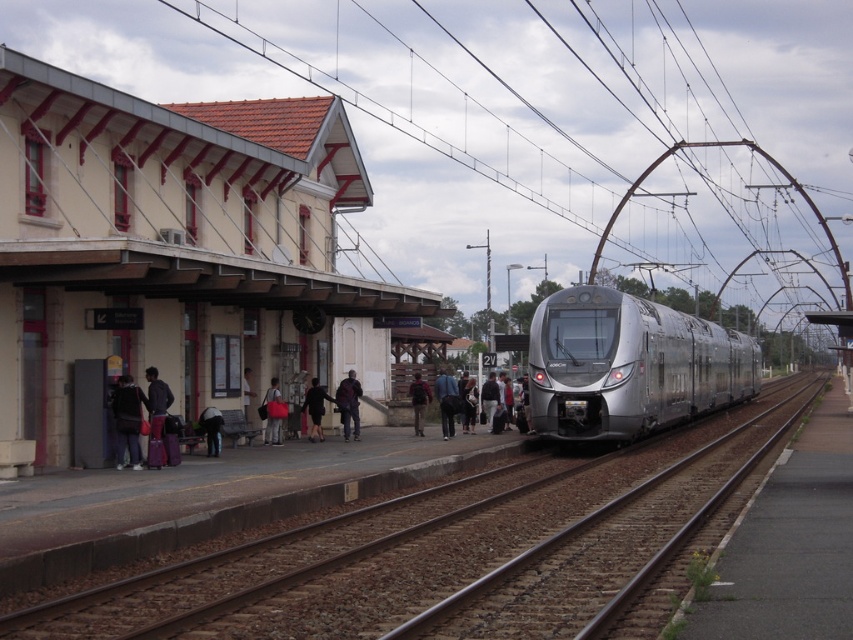
Is silver metallic train at center to the right of dark gray fabric coat at center from the viewer's perspective?

Correct, you'll find silver metallic train at center to the right of dark gray fabric coat at center.

Can you confirm if silver metallic train at center is wider than dark gray fabric coat at center?

Correct, the width of silver metallic train at center exceeds that of dark gray fabric coat at center.

Where is `silver metallic train at center`? This screenshot has height=640, width=853. silver metallic train at center is located at coordinates (630, 365).

Can you confirm if silver metallic train at center is positioned below dark gray fabric backpack at left?

Incorrect, silver metallic train at center is not positioned below dark gray fabric backpack at left.

This screenshot has width=853, height=640. What do you see at coordinates (630, 365) in the screenshot?
I see `silver metallic train at center` at bounding box center [630, 365].

Who is more distant from viewer, (666, 380) or (122, 396)?

The point (666, 380) is behind.

The image size is (853, 640). What are the coordinates of `silver metallic train at center` in the screenshot? It's located at click(x=630, y=365).

Can you confirm if metal tracks at center is taller than matte red bag at center?

No, metal tracks at center is not taller than matte red bag at center.

How distant is metal tracks at center from matte red bag at center?

metal tracks at center and matte red bag at center are 9.10 meters apart.

Who is more forward, [740,483] or [271,396]?

Point [740,483]

Locate an element on the screen. metal tracks at center is located at coordinates (445, 548).